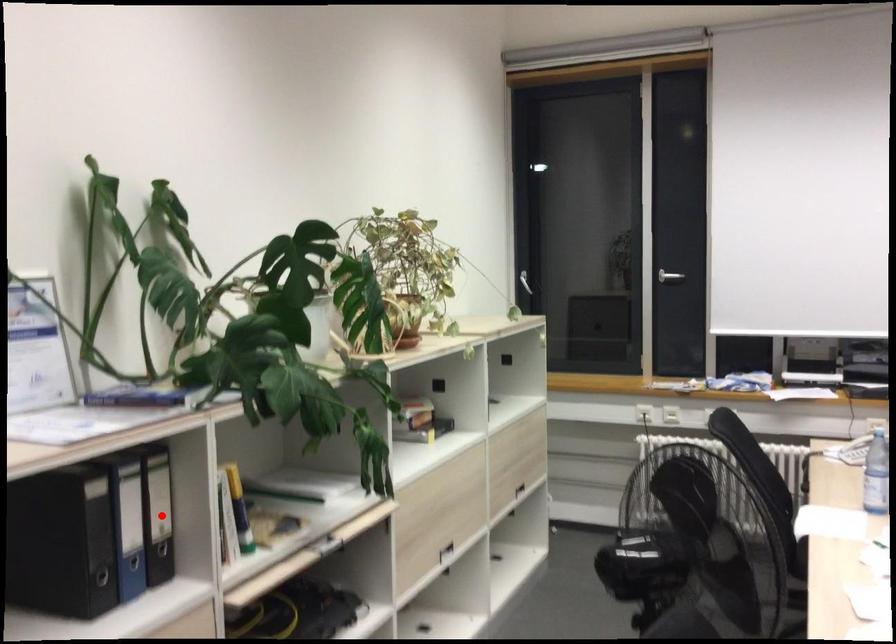
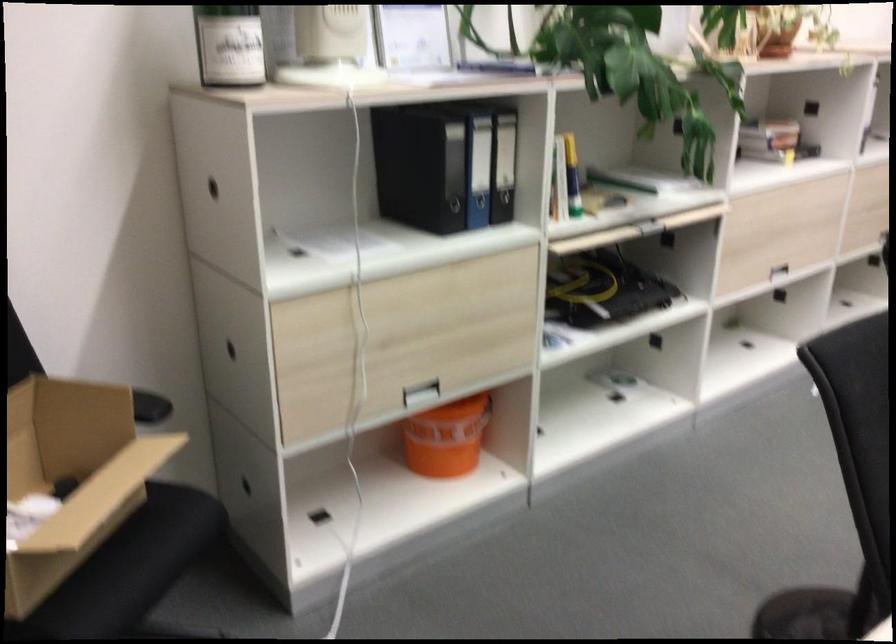
Question: I am providing you with two images of the same scene from different viewpoints. A red point is shown in image1. For the corresponding object point in image2, is it positioned nearer or farther from the camera?

Choices:
 (A) Nearer
 (B) Farther

Answer: (B)